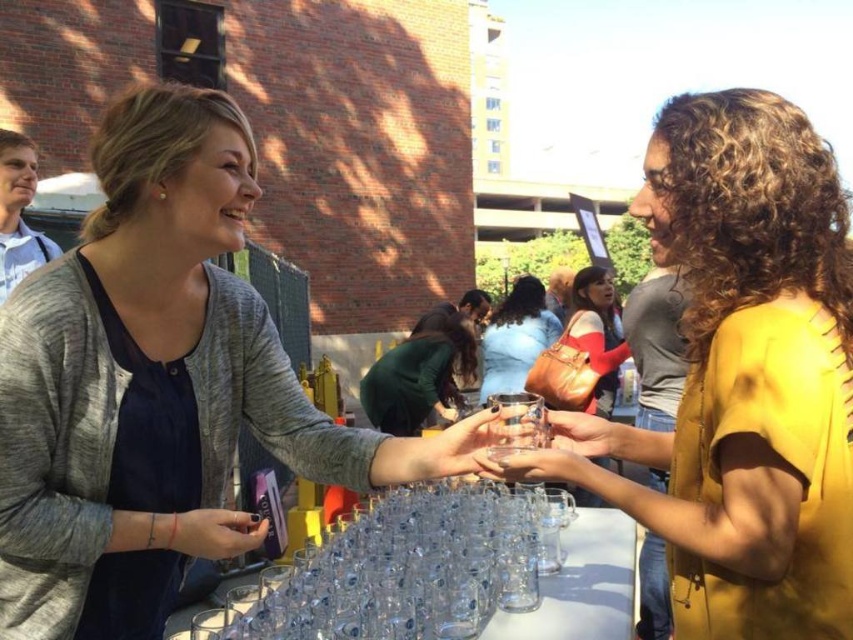
Question: Estimate the real-world distances between objects in this image. Which object is farther from the green fabric shirt at center?

Choices:
 (A) transparent glass cups at center
 (B) matte blue shirt at center
 (C) matte red shirt at center

Answer: (A)

Question: Can you confirm if matte gray cardigan at center is thinner than transparent glass cups at center?

Choices:
 (A) no
 (B) yes

Answer: (A)

Question: Considering the relative positions of transparent glass cups at center and matte red shirt at center in the image provided, where is transparent glass cups at center located with respect to matte red shirt at center?

Choices:
 (A) above
 (B) below

Answer: (B)

Question: Estimate the real-world distances between objects in this image. Which object is closer to the matte blue shirt at center?

Choices:
 (A) transparent glass cups at center
 (B) matte gray cardigan at center
 (C) matte red shirt at center
 (D) green fabric shirt at center

Answer: (C)

Question: Can you confirm if matte gray cardigan at center is positioned below matte red shirt at center?

Choices:
 (A) no
 (B) yes

Answer: (B)

Question: Which point is farther from the camera taking this photo?

Choices:
 (A) (572, 602)
 (B) (241, 211)
 (C) (393, 410)
 (D) (485, 356)

Answer: (D)